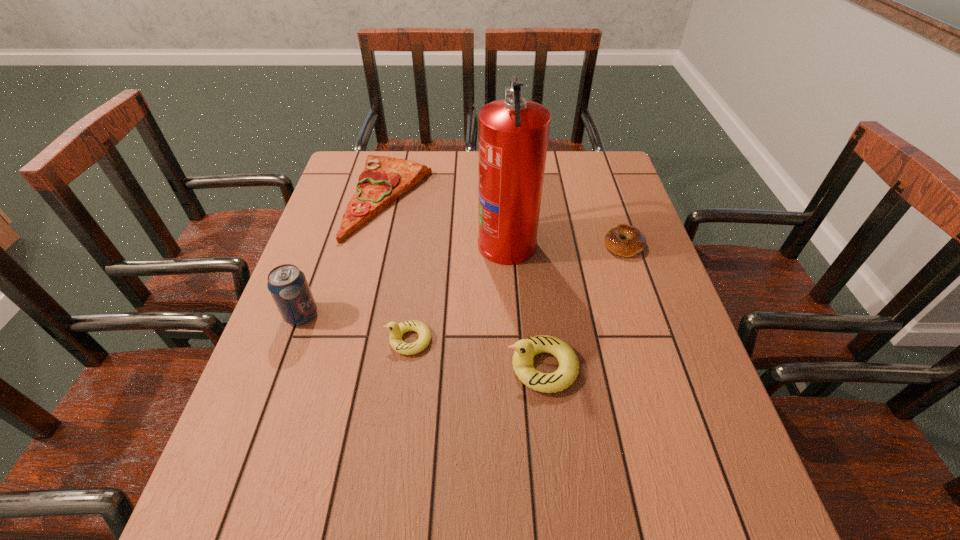
With all ducklings evenly spaced, where should an extra duckling be placed on the right to continue the pattern? Please point out a vacant space. Please provide its 2D coordinates. Your answer should be formatted as a tuple, i.e. [(x, y)], where the tuple contains the x and y coordinates of a point satisfying the conditions above.

[(690, 397)]